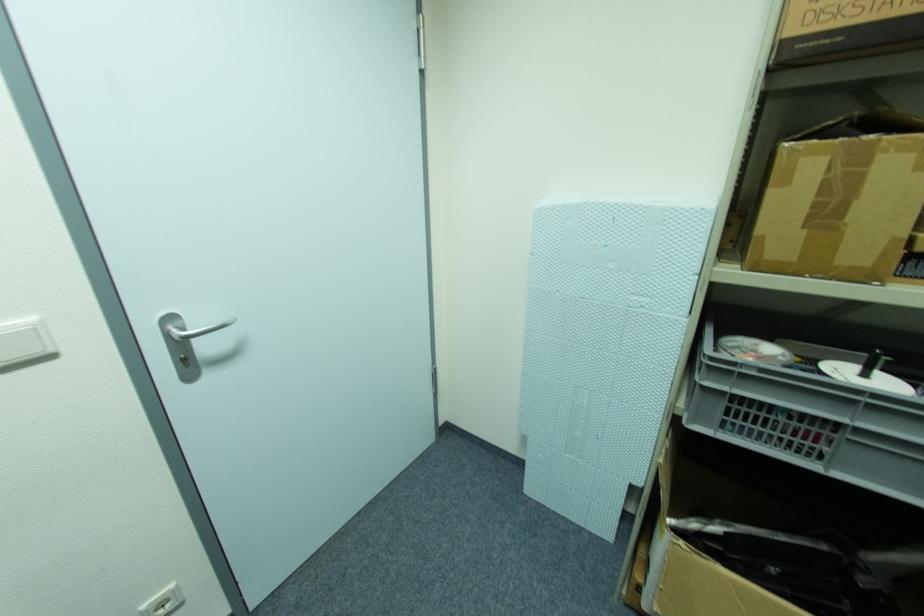
Identify the location of metal door handle. (198, 330).